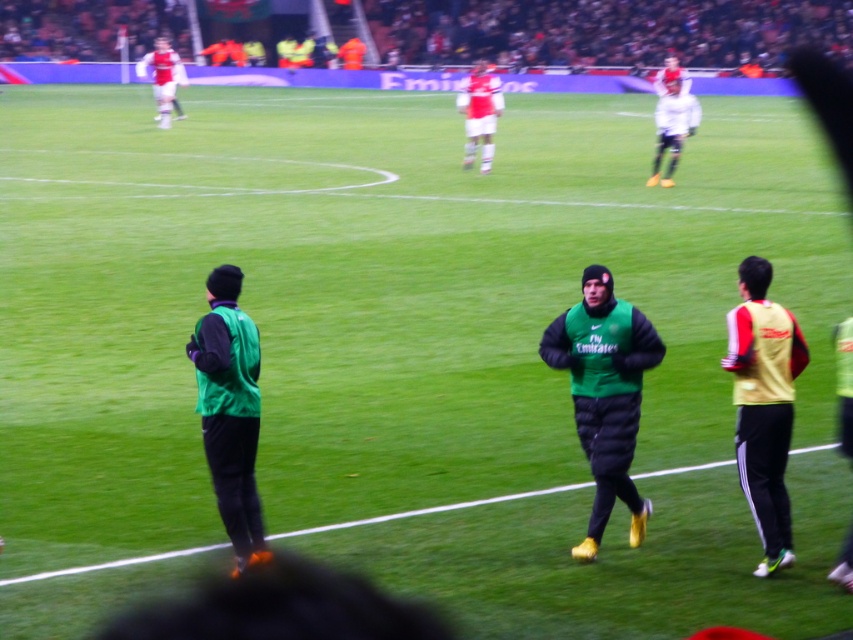
Can you confirm if green matte jacket at center is positioned below matte red shorts at center?

Yes.

Is point (592, 465) positioned before point (482, 68)?

Yes, it is.

Does point (596, 493) come closer to viewer compared to point (490, 161)?

That is True.

Image resolution: width=853 pixels, height=640 pixels. In order to click on green matte jacket at center in this screenshot , I will do `click(604, 394)`.

Is point (762, 570) closer to camera compared to point (492, 120)?

Yes, point (762, 570) is in front of point (492, 120).

The width and height of the screenshot is (853, 640). What do you see at coordinates (763, 404) in the screenshot?
I see `yellow/green jersey at right` at bounding box center [763, 404].

Locate an element on the screen. The width and height of the screenshot is (853, 640). yellow/green jersey at right is located at coordinates (763, 404).

Locate an element on the screen. yellow/green jersey at right is located at coordinates (763, 404).

Which is in front, point (769, 308) or point (157, 84)?

Point (769, 308) is in front.

This screenshot has height=640, width=853. In order to click on yellow/green jersey at right in this screenshot , I will do `click(763, 404)`.